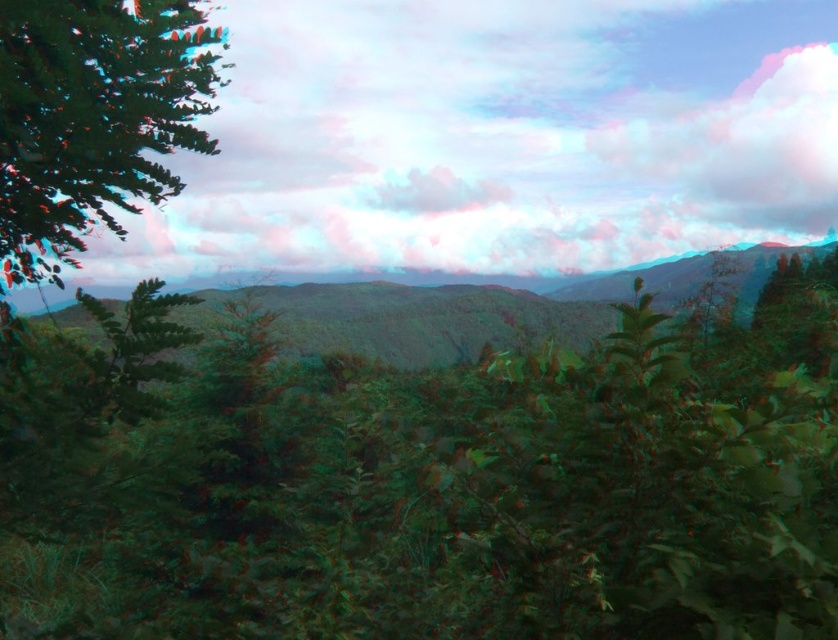
Which is above, green matte leaves at upper left or green leafy mountain at center?

green matte leaves at upper left is above.

Does green matte leaves at upper left have a smaller size compared to green leafy mountain at center?

Yes, green matte leaves at upper left is smaller than green leafy mountain at center.

Where is `green matte leaves at upper left`? green matte leaves at upper left is located at coordinates (94, 118).